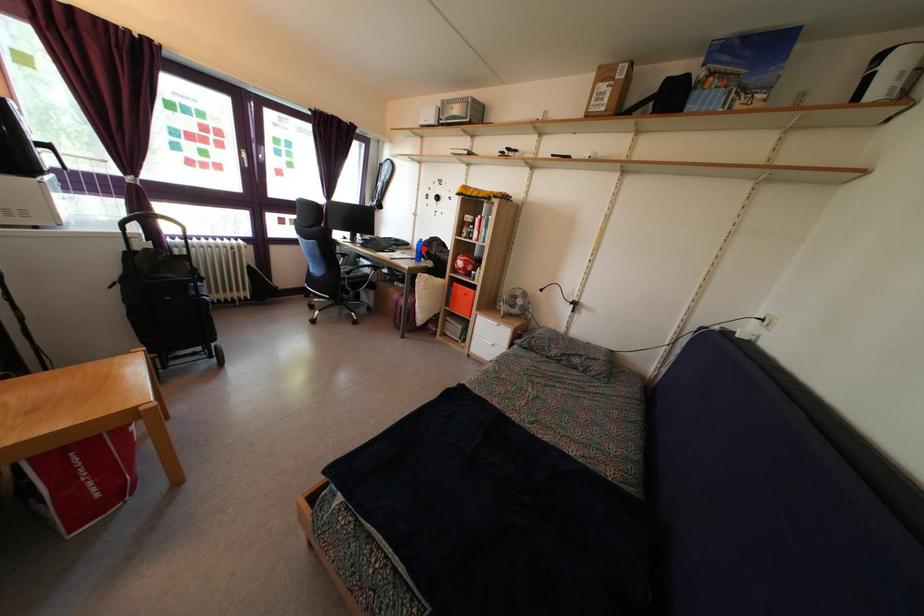
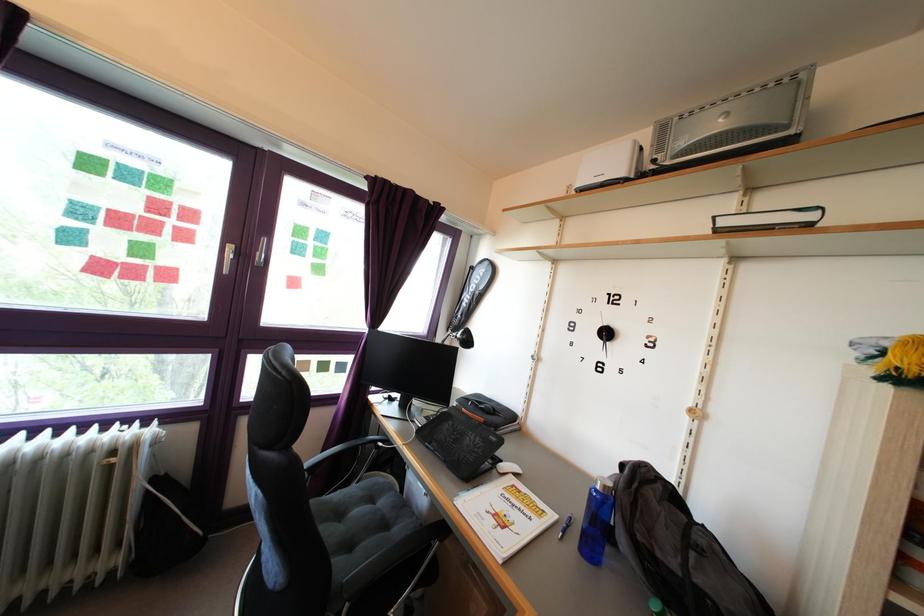
Where in the second image is the point corresponding to the highlighted location from the first image?

(609, 496)